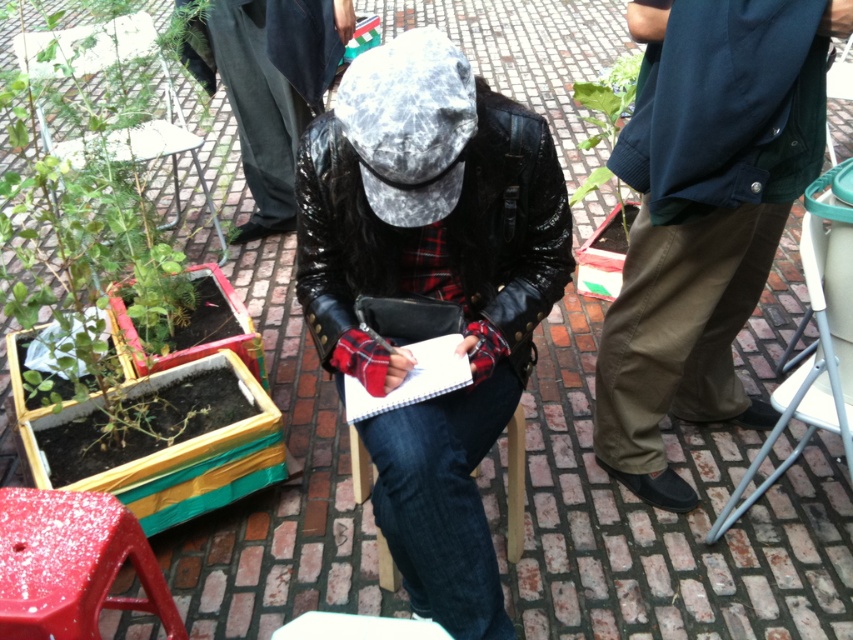
You are standing in the outdoor area and want to place a small potted flower between the smooth plastic stool at lower left and the green leafy plant at upper right. Based on their positions, which object should the flower be closer to?

The smooth plastic stool at lower left is closer to the viewer than the green leafy plant at upper right, so the flower should be placed closer to the smooth plastic stool at lower left to maintain the spatial arrangement.

Where is the leather jacket at center located in the image?

The leather jacket at center is located at point (432, 291).

You are planning to place a new decorative item in the outdoor area. The smooth plastic stool at lower left and the green leafy plant at upper right are already present. Which object would require more space if you want to add another item next to it?

The green leafy plant at upper right requires more space because it occupies more space than the smooth plastic stool at lower left.